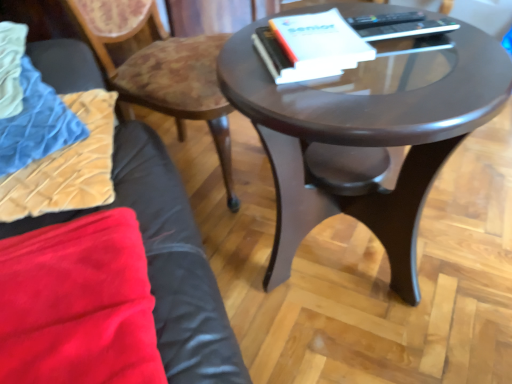
Image resolution: width=512 pixels, height=384 pixels. I want to click on free space that is to the left of white paper at center, so click(244, 59).